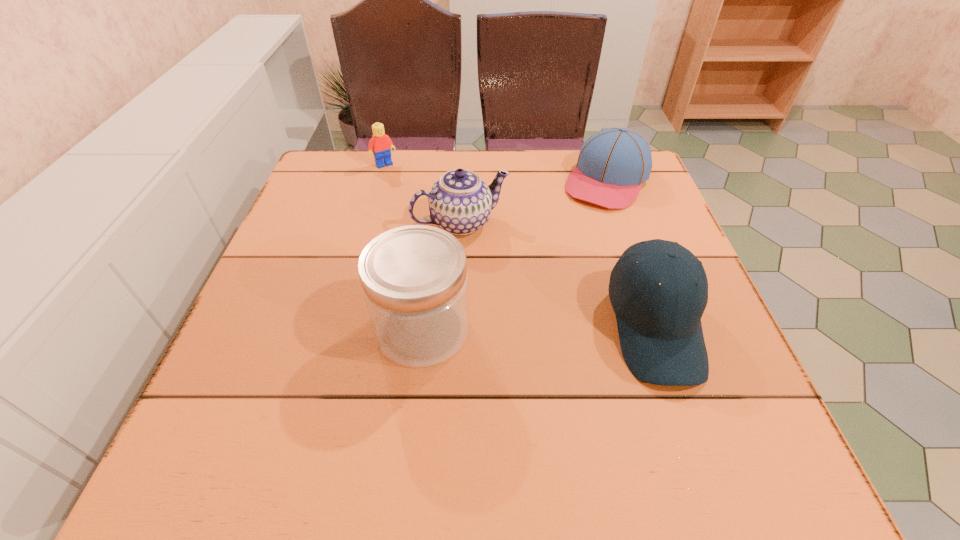
Locate an element on the screen. The width and height of the screenshot is (960, 540). free space that is in between the shorter baseball cap and the chinaware is located at coordinates (534, 202).

Image resolution: width=960 pixels, height=540 pixels. In order to click on free space between the shorter baseball cap and the chinaware in this screenshot , I will do `click(534, 202)`.

At what (x,y) coordinates should I click in order to perform the action: click on free spot between the farther baseball cap and the chinaware. Please return your answer as a coordinate pair (x, y). Looking at the image, I should click on (534, 202).

Find the location of a particular element. Image resolution: width=960 pixels, height=540 pixels. vacant space in between the shorter baseball cap and the chinaware is located at coordinates (534, 202).

You are a GUI agent. You are given a task and a screenshot of the screen. Output one action in this format:
    pyautogui.click(x=<x>, y=<y>)
    Task: Click on the object identified as the closest to the Lego
    Image resolution: width=960 pixels, height=540 pixels.
    Given the screenshot: What is the action you would take?
    pyautogui.click(x=460, y=202)

Choose which object is the third nearest neighbor to the leftmost object. Please provide its 2D coordinates. Your answer should be formatted as a tuple, i.e. [(x, y)], where the tuple contains the x and y coordinates of a point satisfying the conditions above.

[(414, 278)]

Find the location of a particular element. The image size is (960, 540). free location that satisfies the following two spatial constraints: 1. on the back side of the chinaware; 2. on the left side of the shorter baseball cap is located at coordinates (464, 181).